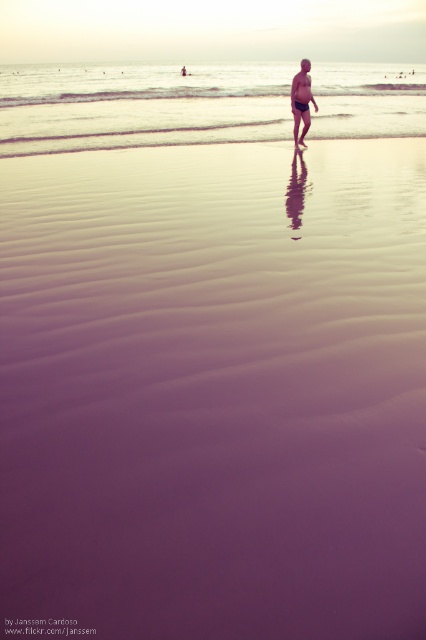
You are a photographer trying to capture the perfect shot of the matte black swim trunks at center and the clear water at center. Which object should you focus on if you want to include both in your frame without cropping?

The clear water at center is larger in size than the matte black swim trunks at center, so focusing on the clear water at center would allow both objects to fit within the frame without cropping.

You are a lifeguard on duty and notice someone in the water. Based on the scene, can you determine if the person wearing the matte black swim trunks at center is currently submerged in the clear water at center?

The clear water at center is above matte black swim trunks at center, which means the person wearing the matte black swim trunks at center is submerged in the clear water at center.